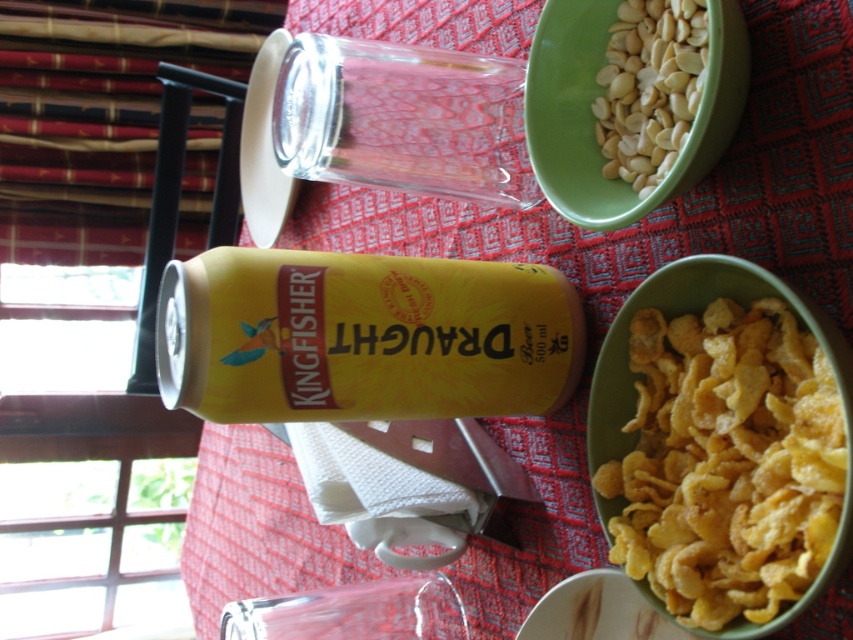
Question: Estimate the real-world distances between objects in this image. Which object is farther from the yellow matte can at center?

Choices:
 (A) green plastic bowl at upper right
 (B) yellow crispy cereal at lower right

Answer: (B)

Question: Which is farther from the green plastic bowl at upper right?

Choices:
 (A) yellow crispy cereal at lower right
 (B) yellow matte can at center
 (C) white matte peanuts at upper right

Answer: (B)

Question: Is yellow crispy cereal at lower right thinner than white matte peanuts at upper right?

Choices:
 (A) no
 (B) yes

Answer: (A)

Question: Does green plastic bowl at upper right appear on the left side of white matte peanuts at upper right?

Choices:
 (A) no
 (B) yes

Answer: (B)

Question: Which object appears closest to the camera in this image?

Choices:
 (A) green plastic bowl at upper right
 (B) yellow matte can at center

Answer: (A)

Question: Can you confirm if yellow matte can at center is positioned to the left of green plastic bowl at upper right?

Choices:
 (A) yes
 (B) no

Answer: (A)